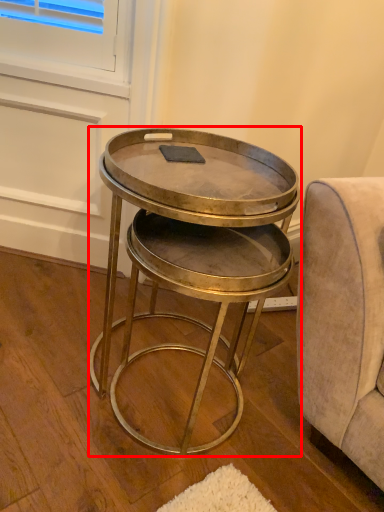
Question: Observing the image, what is the correct spatial positioning of table (annotated by the red box) in reference to pad?

Choices:
 (A) left
 (B) right

Answer: (B)